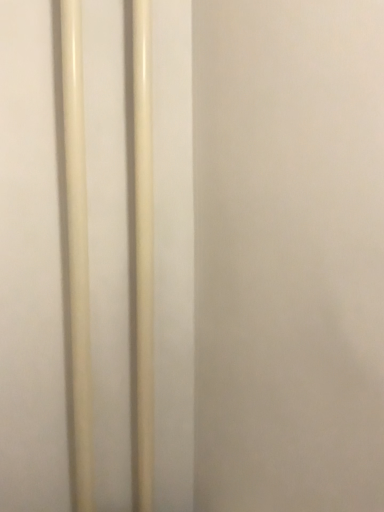
Question: Is matte plastic pole at center, arranged as the 2th pole when viewed from the left, surrounding matte white pole at left, the 2th pole from the right?

Choices:
 (A) yes
 (B) no

Answer: (B)

Question: Does matte plastic pole at center, which appears as the 1th pole when viewed from the right, appear on the right side of matte white pole at left, the 2th pole from the right?

Choices:
 (A) no
 (B) yes

Answer: (B)

Question: Could you tell me if matte plastic pole at center, which appears as the 1th pole when viewed from the right, is turned towards matte white pole at left, acting as the first pole starting from the left?

Choices:
 (A) yes
 (B) no

Answer: (B)

Question: From the image's perspective, is matte plastic pole at center, arranged as the 2th pole when viewed from the left, beneath matte white pole at left, acting as the first pole starting from the left?

Choices:
 (A) yes
 (B) no

Answer: (B)

Question: Does matte plastic pole at center, arranged as the 2th pole when viewed from the left, have a larger size compared to matte white pole at left, the 2th pole from the right?

Choices:
 (A) no
 (B) yes

Answer: (A)

Question: Can you confirm if matte plastic pole at center, arranged as the 2th pole when viewed from the left, is positioned to the left of matte white pole at left, acting as the first pole starting from the left?

Choices:
 (A) yes
 (B) no

Answer: (B)

Question: From a real-world perspective, is matte white pole at left, the 2th pole from the right, located higher than matte plastic pole at center, arranged as the 2th pole when viewed from the left?

Choices:
 (A) no
 (B) yes

Answer: (B)

Question: Considering the relative sizes of matte white pole at left, acting as the first pole starting from the left, and matte plastic pole at center, which appears as the 1th pole when viewed from the right, in the image provided, is matte white pole at left, acting as the first pole starting from the left, smaller than matte plastic pole at center, which appears as the 1th pole when viewed from the right,?

Choices:
 (A) no
 (B) yes

Answer: (A)

Question: Could you tell me if matte white pole at left, the 2th pole from the right, is facing matte plastic pole at center, arranged as the 2th pole when viewed from the left?

Choices:
 (A) no
 (B) yes

Answer: (A)

Question: Can you confirm if matte white pole at left, acting as the first pole starting from the left, is positioned to the right of matte plastic pole at center, which appears as the 1th pole when viewed from the right?

Choices:
 (A) yes
 (B) no

Answer: (B)

Question: Is there a large distance between matte white pole at left, the 2th pole from the right, and matte plastic pole at center, arranged as the 2th pole when viewed from the left?

Choices:
 (A) yes
 (B) no

Answer: (B)

Question: From a real-world perspective, does matte white pole at left, acting as the first pole starting from the left, sit lower than matte plastic pole at center, which appears as the 1th pole when viewed from the right?

Choices:
 (A) no
 (B) yes

Answer: (A)

Question: Is matte plastic pole at center, which appears as the 1th pole when viewed from the right, bigger or smaller than matte white pole at left, acting as the first pole starting from the left?

Choices:
 (A) big
 (B) small

Answer: (B)